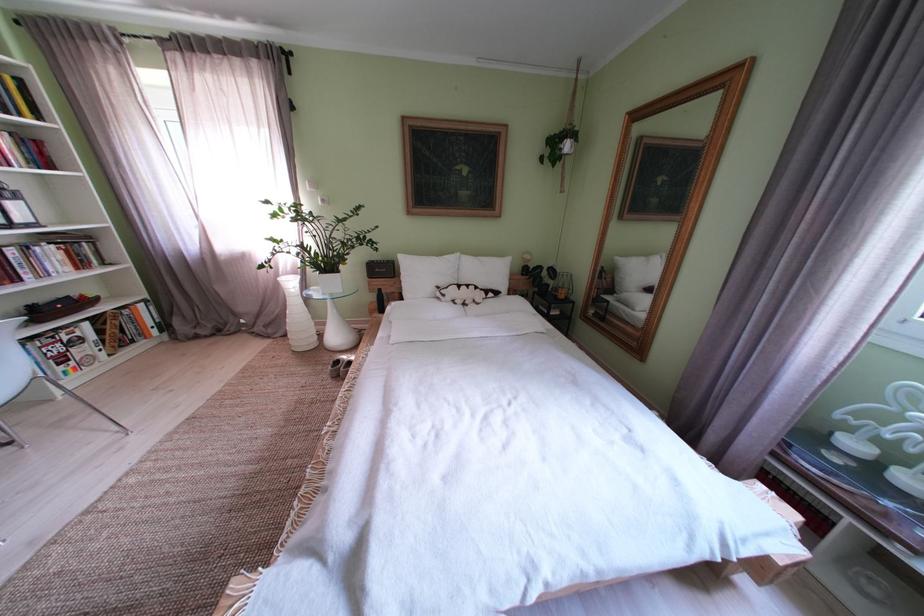
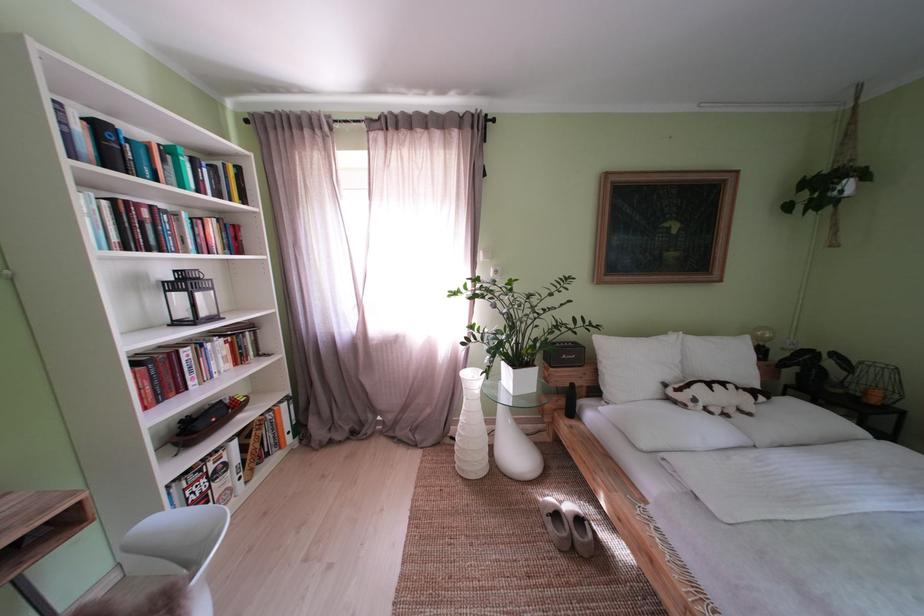
In the second image, find the point that corresponds to the point at 348,367 in the first image.

(567, 521)